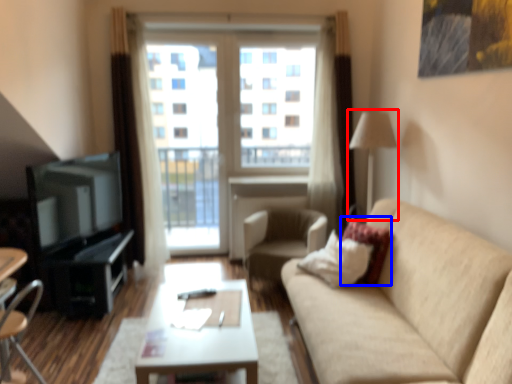
Question: Which object appears closest to the camera in this image, lamp (highlighted by a red box) or pillow (highlighted by a blue box)?

Choices:
 (A) lamp
 (B) pillow

Answer: (B)